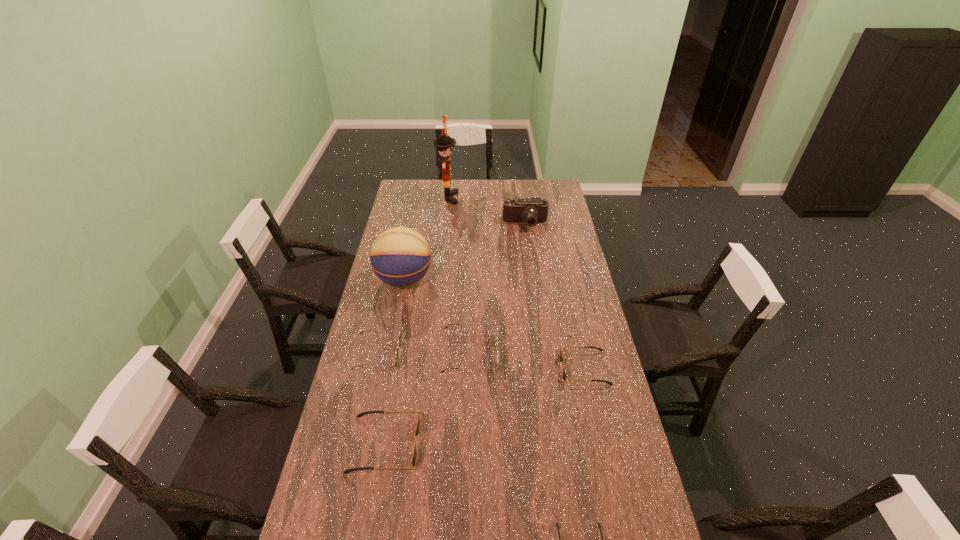
Locate an element on the screen. free spot between the second nearest black sunglasses and the leftmost green sunglasses is located at coordinates (381, 399).

Where is `vacant point located between the biggest green sunglasses and the biggest black sunglasses`? The height and width of the screenshot is (540, 960). vacant point located between the biggest green sunglasses and the biggest black sunglasses is located at coordinates (427, 399).

Where is `vacant space that is in between the biggest green sunglasses and the third tallest object`? This screenshot has height=540, width=960. vacant space that is in between the biggest green sunglasses and the third tallest object is located at coordinates (497, 288).

Where is `free area in between the farthest black sunglasses and the biggest green sunglasses`? This screenshot has height=540, width=960. free area in between the farthest black sunglasses and the biggest green sunglasses is located at coordinates (527, 361).

This screenshot has height=540, width=960. I want to click on unoccupied area between the second smallest green sunglasses and the biggest green sunglasses, so click(x=423, y=354).

Where is `vacant area that lies between the camera and the tallest object`? This screenshot has height=540, width=960. vacant area that lies between the camera and the tallest object is located at coordinates (487, 211).

Identify which object is located as the fifth nearest to the second biggest green sunglasses. Please provide its 2D coordinates. Your answer should be formatted as a tuple, i.e. [(x, y)], where the tuple contains the x and y coordinates of a point satisfying the conditions above.

[(561, 358)]

Locate which object is the fourth closest to the nearest black sunglasses. Please provide its 2D coordinates. Your answer should be formatted as a tuple, i.e. [(x, y)], where the tuple contains the x and y coordinates of a point satisfying the conditions above.

[(496, 323)]

Locate an element on the screen. This screenshot has width=960, height=540. the third closest sunglasses to the second farthest object is located at coordinates (400, 334).

Locate an element on the screen. The image size is (960, 540). sunglasses that stands as the second closest to the nearest black sunglasses is located at coordinates (417, 430).